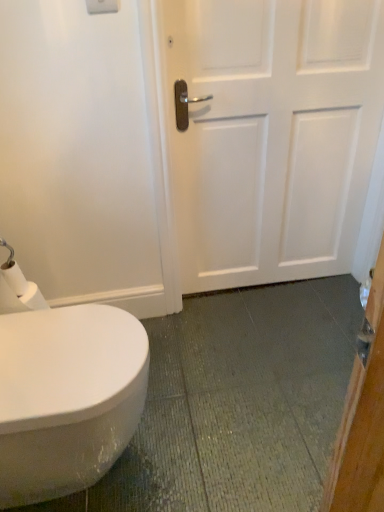
Question: Is white matte toilet paper at lower left located within white matte door at center?

Choices:
 (A) yes
 (B) no

Answer: (B)

Question: Does white matte door at center touch white matte toilet paper at lower left?

Choices:
 (A) yes
 (B) no

Answer: (B)

Question: Is white matte door at center behind white matte toilet paper at lower left?

Choices:
 (A) yes
 (B) no

Answer: (A)

Question: Does white matte door at center appear on the right side of white matte toilet paper at lower left?

Choices:
 (A) no
 (B) yes

Answer: (B)

Question: Is white matte door at center turned away from white matte toilet paper at lower left?

Choices:
 (A) no
 (B) yes

Answer: (A)

Question: From a real-world perspective, does white matte door at center stand above white matte toilet paper at lower left?

Choices:
 (A) no
 (B) yes

Answer: (B)

Question: Is white glossy bidet at lower left smaller than white matte toilet paper at lower left?

Choices:
 (A) yes
 (B) no

Answer: (B)

Question: From the image's perspective, is white glossy bidet at lower left on white matte toilet paper at lower left?

Choices:
 (A) yes
 (B) no

Answer: (B)

Question: Is white glossy bidet at lower left completely or partially outside of white matte toilet paper at lower left?

Choices:
 (A) yes
 (B) no

Answer: (A)

Question: Can you confirm if white glossy bidet at lower left is positioned to the right of white matte toilet paper at lower left?

Choices:
 (A) yes
 (B) no

Answer: (A)

Question: Is white glossy bidet at lower left thinner than white matte toilet paper at lower left?

Choices:
 (A) no
 (B) yes

Answer: (A)

Question: Can you confirm if white glossy bidet at lower left is wider than white matte toilet paper at lower left?

Choices:
 (A) yes
 (B) no

Answer: (A)

Question: Can you confirm if white glossy bidet at lower left is bigger than white matte door at center?

Choices:
 (A) yes
 (B) no

Answer: (A)